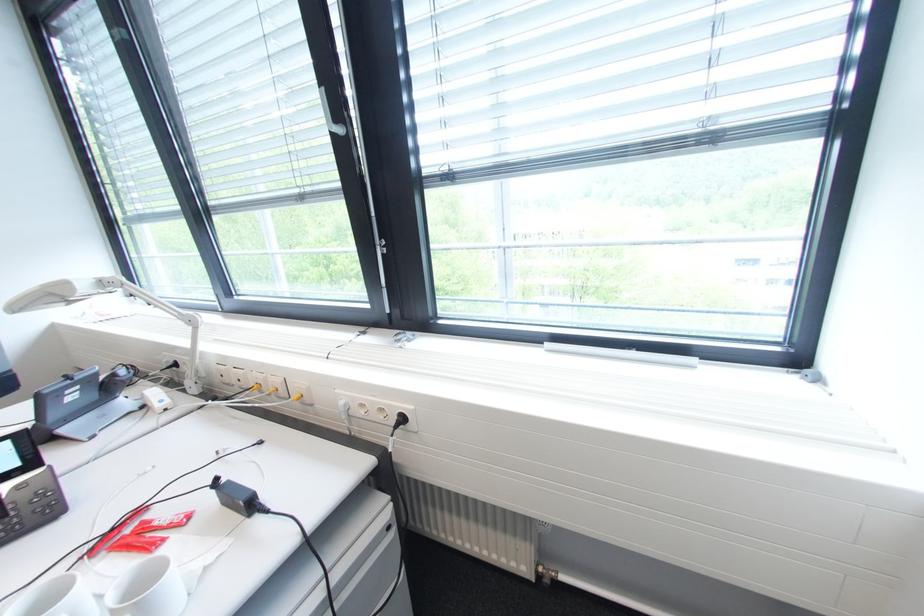
The height and width of the screenshot is (616, 924). I want to click on blind cord winder, so click(x=448, y=175).